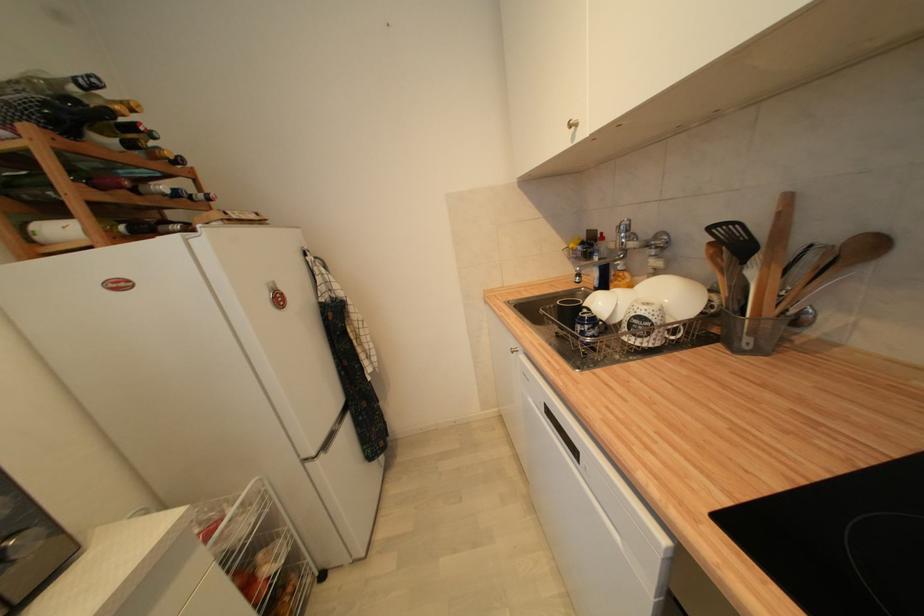
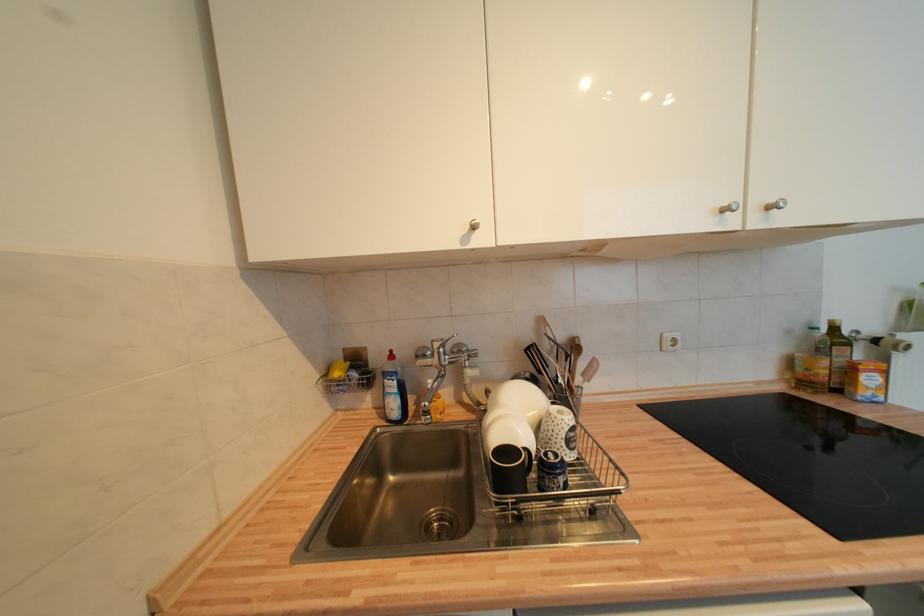
Question: Based on the continuous images, in which direction is the camera rotating? Reply with the corresponding letter.

Choices:
 (A) Left
 (B) Right
 (C) Up
 (D) Down

Answer: (B)